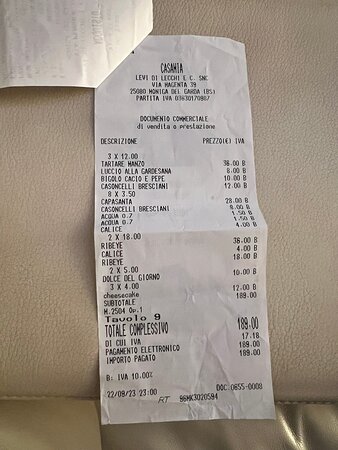
Locate an element on the screen. This screenshot has width=338, height=450. leather is located at coordinates (59, 303).